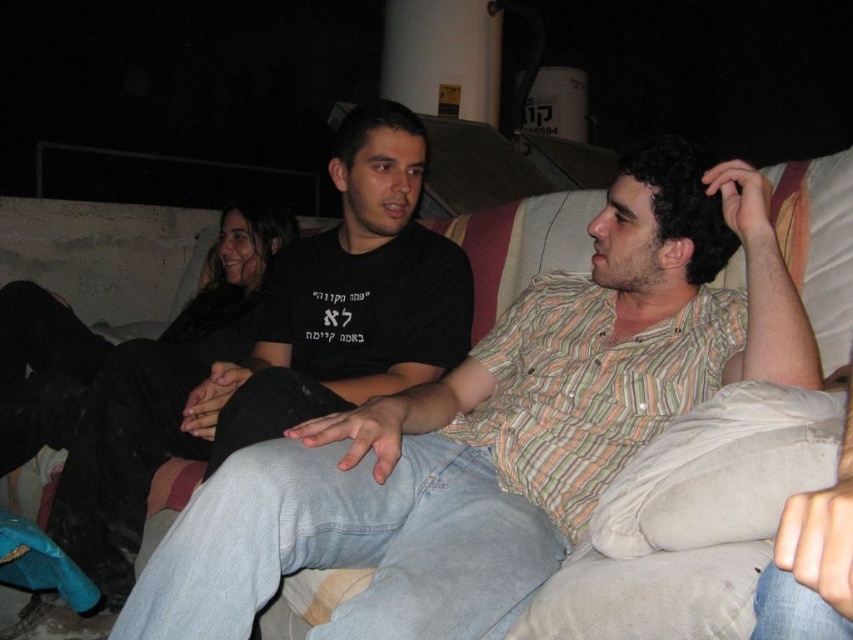
Question: Which point is closer to the camera?

Choices:
 (A) black cotton shirt at center
 (B) striped cotton shirt at center

Answer: (B)

Question: Does striped cotton shirt at center have a smaller size compared to black cotton shirt at center?

Choices:
 (A) no
 (B) yes

Answer: (B)

Question: Is striped cotton shirt at center in front of black cotton shirt at center?

Choices:
 (A) no
 (B) yes

Answer: (B)

Question: Among these points, which one is nearest to the camera?

Choices:
 (A) (692, 209)
 (B) (397, 102)

Answer: (A)

Question: Does striped cotton shirt at center appear on the right side of black cotton shirt at center?

Choices:
 (A) yes
 (B) no

Answer: (A)

Question: Which of the following is the closest to the observer?

Choices:
 (A) black cotton shirt at center
 (B) striped cotton shirt at center

Answer: (B)